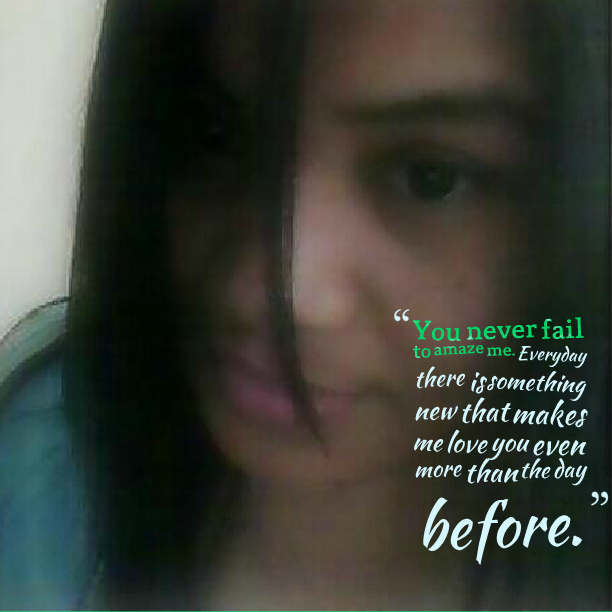
Locate an element on the screen. This screenshot has width=612, height=612. white wall is located at coordinates (57, 92).